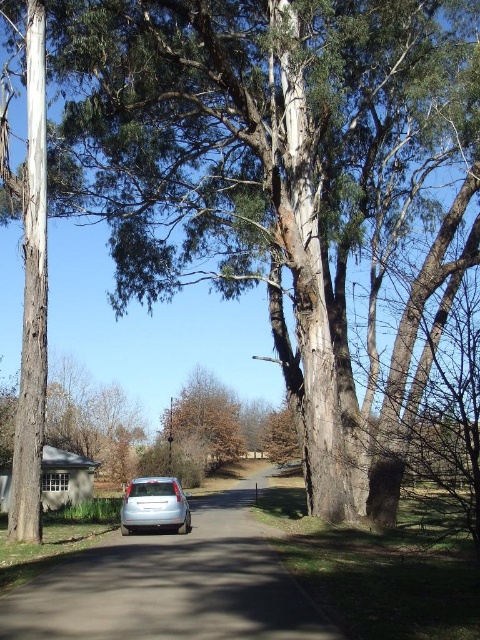
Question: Estimate the real-world distances between objects in this image. Which object is farther from the brown rough tree at center?

Choices:
 (A) silver metallic car at center
 (B) satin silver car at center

Answer: (A)

Question: Which point appears closest to the camera in this image?

Choices:
 (A) (189, 452)
 (B) (144, 628)

Answer: (B)

Question: Does brown rough tree at center have a larger size compared to satin silver car at center?

Choices:
 (A) yes
 (B) no

Answer: (B)

Question: Which point is farther from the camera taking this photo?

Choices:
 (A) (216, 451)
 (B) (163, 490)

Answer: (A)

Question: Is silver metallic car at center above satin silver car at center?

Choices:
 (A) yes
 (B) no

Answer: (B)

Question: Does brown rough tree at center have a greater width compared to satin silver car at center?

Choices:
 (A) no
 (B) yes

Answer: (B)